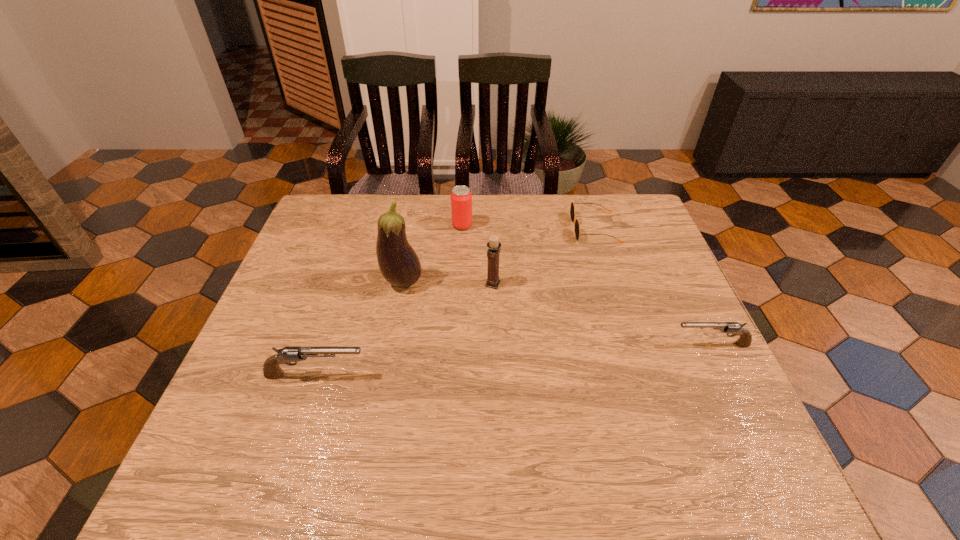
Where is `candle holder`? The image size is (960, 540). candle holder is located at coordinates (494, 245).

Identify the location of free space located aiming along the barrel of the nearer gun. (536, 375).

Find the location of a particular element. free space located 0.240m aiming along the barrel of the shorter gun is located at coordinates (570, 345).

I want to click on free space located 0.050m aiming along the barrel of the shorter gun, so click(652, 345).

Find the location of a particular element. The height and width of the screenshot is (540, 960). vacant space located aiming along the barrel of the shorter gun is located at coordinates pyautogui.click(x=609, y=345).

This screenshot has width=960, height=540. In order to click on vacant area situated 0.170m on the front-facing side of the sunglasses in this screenshot , I will do `click(516, 228)`.

Find the location of a particular element. The height and width of the screenshot is (540, 960). vacant space located on the front-facing side of the sunglasses is located at coordinates (533, 228).

Identify the location of vacant space situated 0.080m on the front-facing side of the sunglasses. (545, 228).

At what (x,y) coordinates should I click in order to perform the action: click on free spot located 0.390m on the front of the beer can. Please return your answer as a coordinate pair (x, y). The width and height of the screenshot is (960, 540). Looking at the image, I should click on (457, 329).

Identify the location of vacant space located on the back of the eggplant. (414, 222).